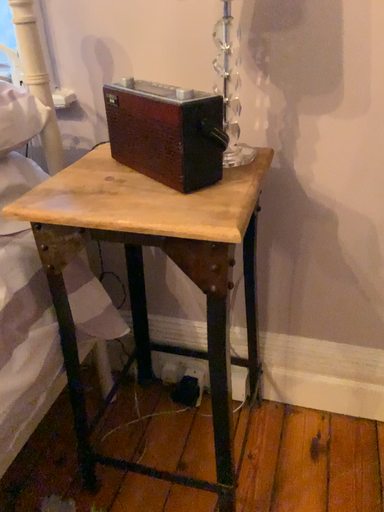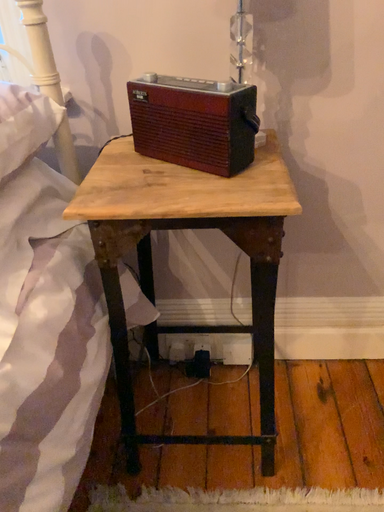
Question: Which way did the camera rotate in the video?

Choices:
 (A) rotated left
 (B) rotated right

Answer: (B)